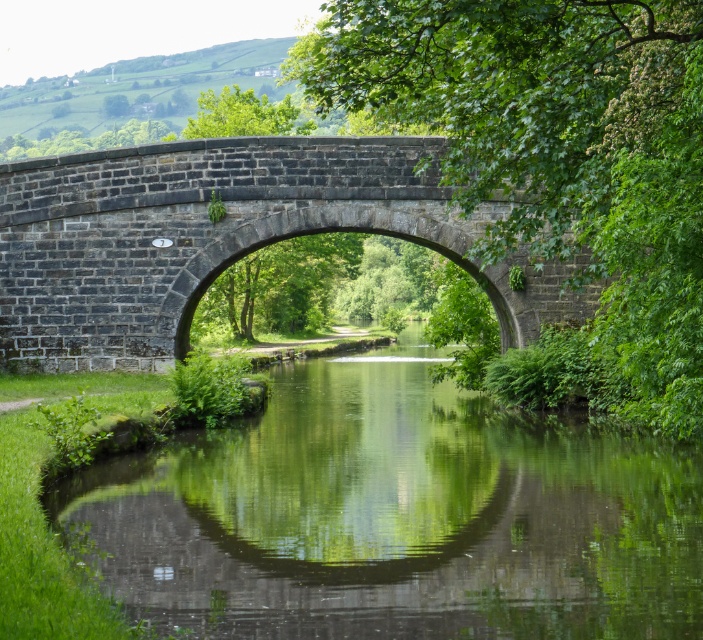
You are standing on the bank of the canal and want to cross to the other side. The dark gray stone bridge at center is your only option. However, you notice the green reflective water at center is very still. Do you think the water is deep enough to swim across instead of using the bridge?

The green reflective water at center is closer to the viewer than the dark gray stone bridge at center, but the depth of the water cannot be determined from the scene description. You should use the bridge to cross safely.

You are a tourist standing on the bank of the canal and want to take a photo of the dark gray stone bridge at center and the green reflective water at center. Which object appears taller in your photo?

The dark gray stone bridge at center appears taller than the green reflective water at center in the photo because the green reflective water at center is not as tall as the dark gray stone bridge at center.

You are a boat operator who needs to navigate a 6.5 meter long boat under the dark gray stone bridge at center. The boat must stay centered in the green reflective water at center to avoid hitting the sides. Can the boat safely pass under the bridge without touching it?

The distance between the green reflective water at center and the dark gray stone stone bridge at center is 7.05 meters. Since the boat is 6.5 meters long, it can safely pass under the bridge as the clearance is sufficient.